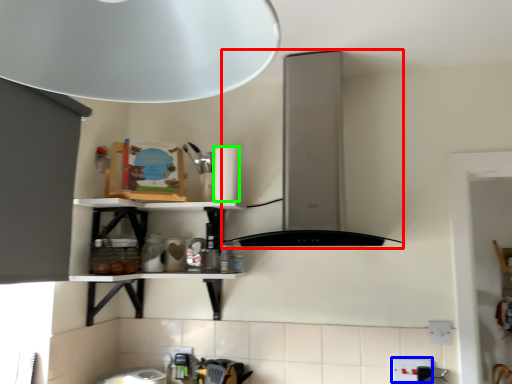
Question: Estimate the real-world distances between objects in this image. Which object is closer to vent (highlighted by a red box), electric outlet (highlighted by a blue box) or paper towel (highlighted by a green box)?

Choices:
 (A) electric outlet
 (B) paper towel

Answer: (B)